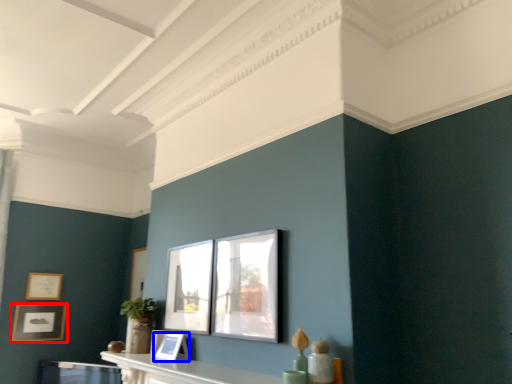
Question: Which of the following is the farthest to the observer, picture frame (highlighted by a red box) or picture frame (highlighted by a blue box)?

Choices:
 (A) picture frame
 (B) picture frame

Answer: (A)